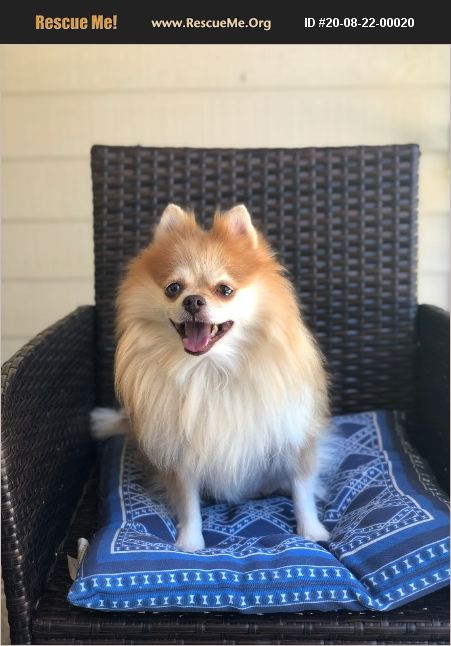
Where is `blue pillow`? The image size is (451, 646). blue pillow is located at coordinates (270, 556).